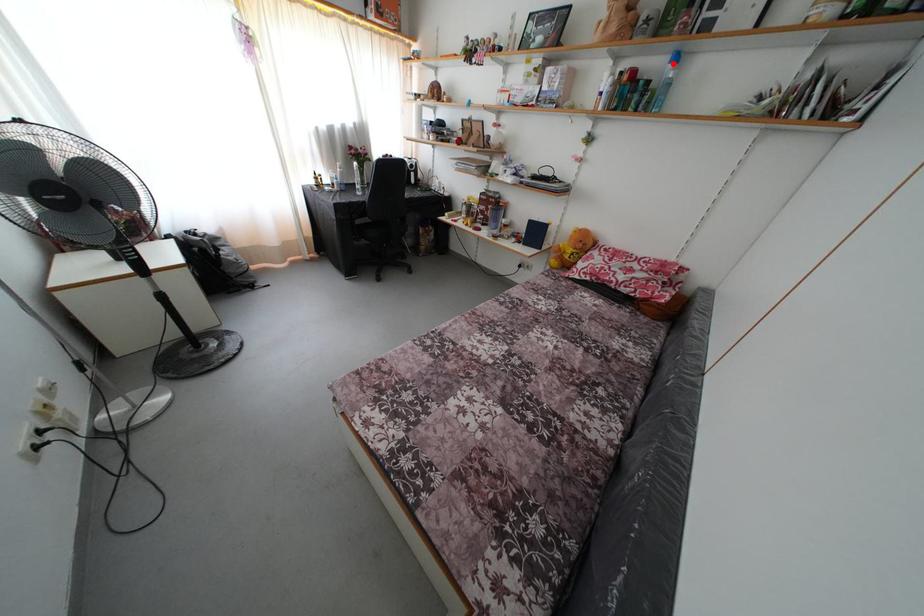
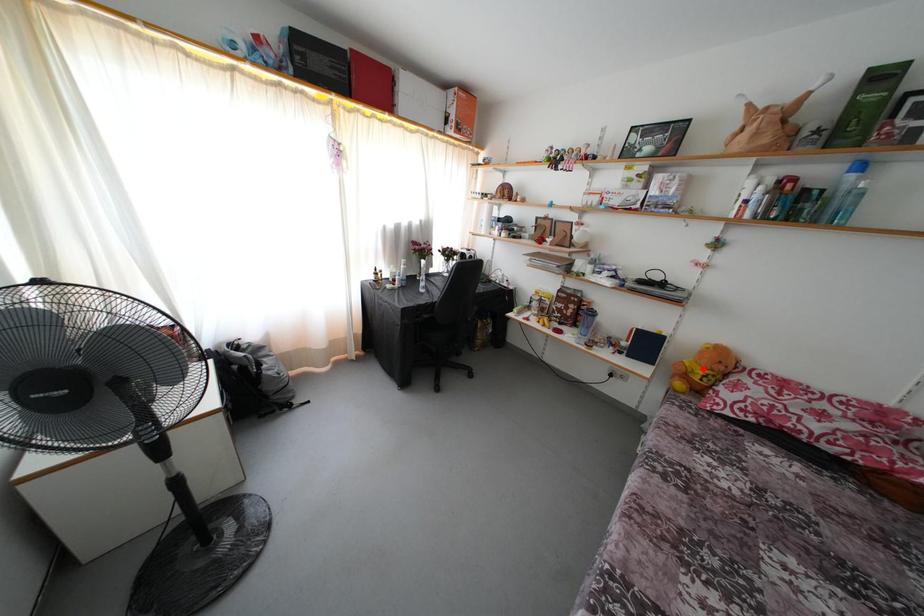
In the scene shown: I am providing you with two images of the same scene from different viewpoints. A red point is marked on the first image and another point is marked on the second image. Are the points marked in image1 and image2 representing the same 3D position?

No